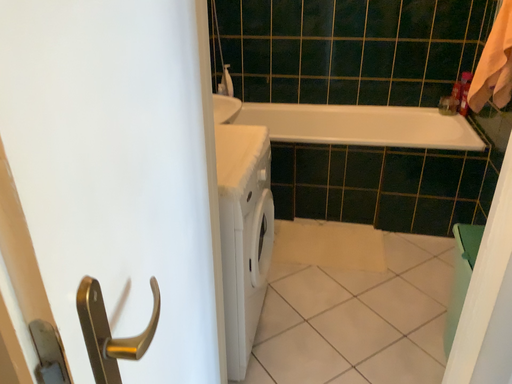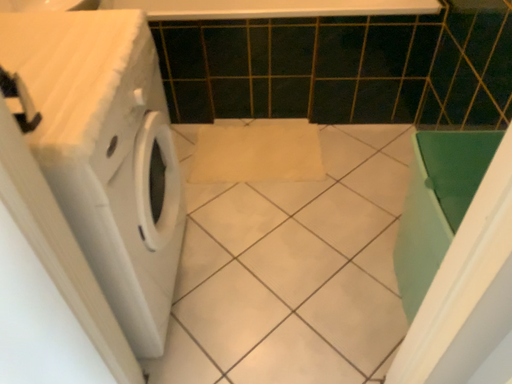
Question: Which way did the camera rotate in the video?

Choices:
 (A) rotated left
 (B) rotated right

Answer: (B)